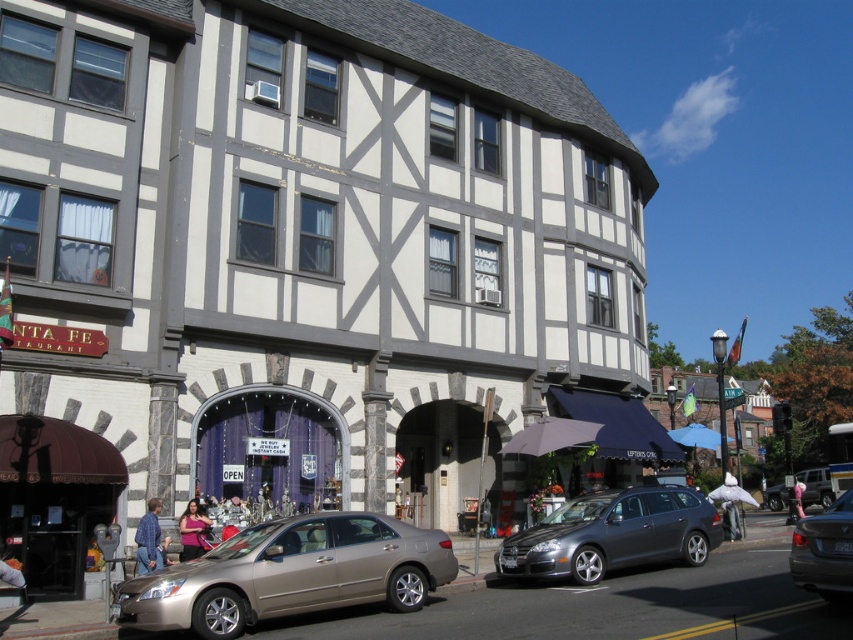
Question: Is gold metallic sedan at center positioned before metallic silver sedan at center?

Choices:
 (A) no
 (B) yes

Answer: (A)

Question: Which point appears farthest from the camera in this image?

Choices:
 (A) click(815, 573)
 (B) click(621, 504)
 (C) click(248, 611)

Answer: (B)

Question: Which object is positioned farthest from the gold metallic sedan at center?

Choices:
 (A) metallic gray station wagon at center
 (B) metallic silver sedan at center

Answer: (B)

Question: Is metallic gray station wagon at center bigger than metallic silver sedan at center?

Choices:
 (A) no
 (B) yes

Answer: (A)

Question: Does gold metallic sedan at center appear under metallic silver sedan at center?

Choices:
 (A) no
 (B) yes

Answer: (B)

Question: Which point is closer to the camera?

Choices:
 (A) gold metallic sedan at center
 (B) metallic silver sedan at center
 (C) metallic gray station wagon at center

Answer: (B)